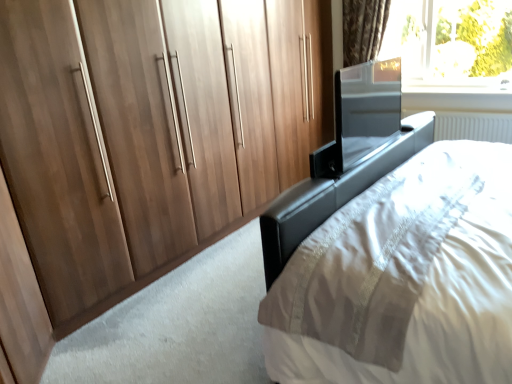
Question: In terms of size, does transparent glass window at upper right appear bigger or smaller than black leather bed at center?

Choices:
 (A) big
 (B) small

Answer: (B)

Question: Is transparent glass window at upper right inside or outside of black leather bed at center?

Choices:
 (A) outside
 (B) inside

Answer: (A)

Question: Which is nearer to the transparent glass window at upper right?

Choices:
 (A) black leather bed at center
 (B) glossy metallic screen door at upper right
 (C) walnut wood wardrobe at left

Answer: (C)

Question: Estimate the real-world distances between objects in this image. Which object is farther from the black leather bed at center?

Choices:
 (A) glossy metallic screen door at upper right
 (B) walnut wood wardrobe at left
 (C) transparent glass window at upper right

Answer: (C)